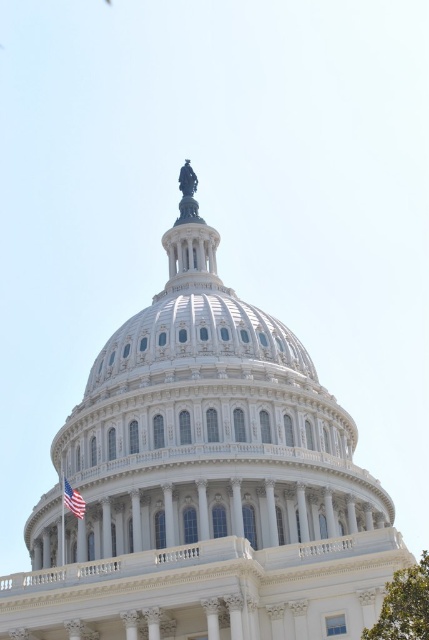
Question: Does white marble dome at center have a larger size compared to american flag at lower left?

Choices:
 (A) yes
 (B) no

Answer: (A)

Question: Which object is farther from the camera taking this photo?

Choices:
 (A) american flag at lower left
 (B) white marble dome at center

Answer: (A)

Question: Does white marble dome at center have a smaller size compared to green leafy tree at lower right?

Choices:
 (A) no
 (B) yes

Answer: (B)

Question: Which object appears closest to the camera in this image?

Choices:
 (A) american flag at lower left
 (B) white marble dome at center
 (C) green leafy tree at lower right

Answer: (C)

Question: Does green leafy tree at lower right have a greater width compared to american flag at lower left?

Choices:
 (A) no
 (B) yes

Answer: (B)

Question: Which object is closer to the camera taking this photo?

Choices:
 (A) white marble dome at center
 (B) american flag at lower left
 (C) green leafy tree at lower right

Answer: (C)